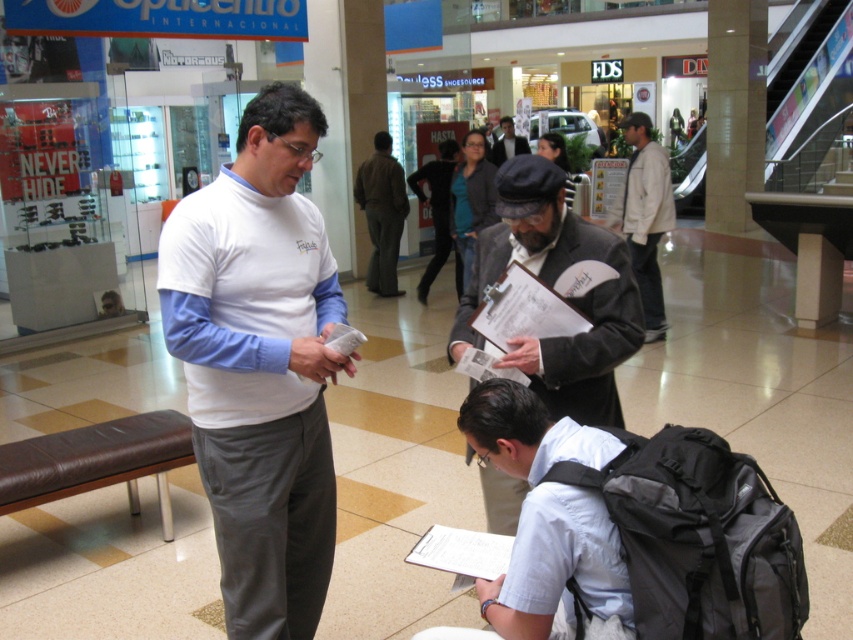
Does white shirt at lower center have a larger size compared to light beige jacket at center?

Actually, white shirt at lower center might be smaller than light beige jacket at center.

Between white shirt at lower center and light beige jacket at center, which one appears on the right side from the viewer's perspective?

light beige jacket at center is more to the right.

Between point (474, 435) and point (643, 289), which one is positioned in front?

Point (474, 435)

You are a GUI agent. You are given a task and a screenshot of the screen. Output one action in this format:
    pyautogui.click(x=<x>, y=<y>)
    Task: Click on the white shirt at lower center
    The height and width of the screenshot is (640, 853).
    Given the screenshot: What is the action you would take?
    pyautogui.click(x=544, y=524)

Is dark gray leather jacket at center to the right of matte black suit at center from the viewer's perspective?

No, dark gray leather jacket at center is not to the right of matte black suit at center.

Which is behind, point (619, 324) or point (508, 124)?

The point (508, 124) is more distant.

Does point (567, 390) come farther from viewer compared to point (508, 129)?

No, (567, 390) is in front of (508, 129).

Locate an element on the screen. This screenshot has width=853, height=640. dark gray leather jacket at center is located at coordinates (550, 288).

Is point (518, 476) closer to viewer compared to point (573, 250)?

Yes, it is in front of point (573, 250).

Image resolution: width=853 pixels, height=640 pixels. I want to click on white shirt at lower center, so click(x=544, y=524).

Measure the distance between white shirt at lower center and camera.

1.67 meters

Locate an element on the screen. The image size is (853, 640). white shirt at lower center is located at coordinates pyautogui.click(x=544, y=524).